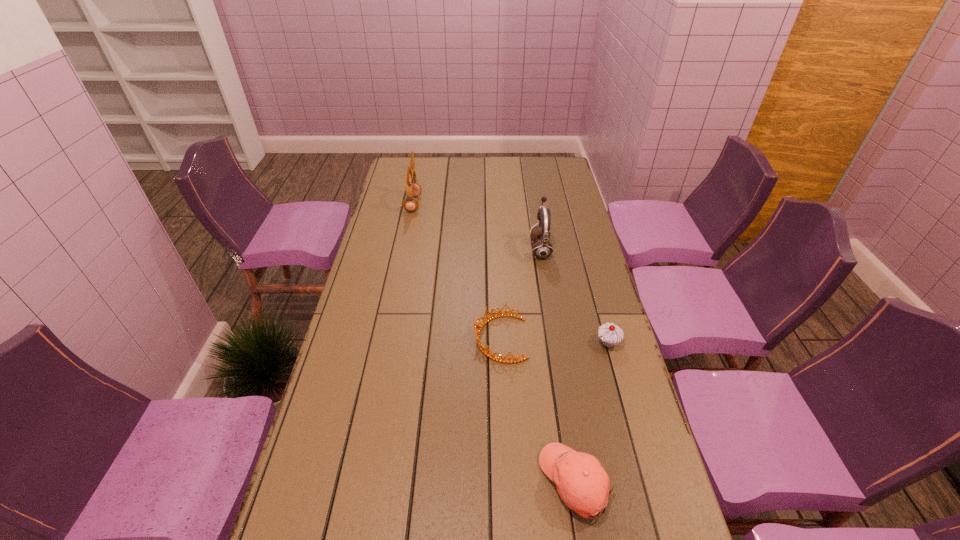
Locate an element on the screen. Image resolution: width=960 pixels, height=540 pixels. baseball cap present at the right edge is located at coordinates (582, 483).

At what (x,y) coordinates should I click in order to perform the action: click on vacant space at the far edge of the desktop. Please return your answer as a coordinate pair (x, y). The image size is (960, 540). Looking at the image, I should click on (488, 176).

I want to click on vacant area at the left edge of the desktop, so click(379, 235).

This screenshot has height=540, width=960. I want to click on free region at the right edge of the desktop, so click(560, 194).

Locate an element on the screen. The height and width of the screenshot is (540, 960). vacant space at the far left corner is located at coordinates (396, 162).

Locate an element on the screen. The image size is (960, 540). free area in between the shortest object and the nearer earphone is located at coordinates (520, 294).

Where is `free space between the nearest object and the rightmost object`? free space between the nearest object and the rightmost object is located at coordinates (591, 412).

This screenshot has width=960, height=540. Identify the location of free area in between the nearest object and the tiara. (538, 410).

Locate an element on the screen. Image resolution: width=960 pixels, height=540 pixels. free space that is in between the nearer earphone and the farthest object is located at coordinates (477, 226).

The height and width of the screenshot is (540, 960). I want to click on empty location between the fourth nearest object and the nearest object, so click(x=558, y=366).